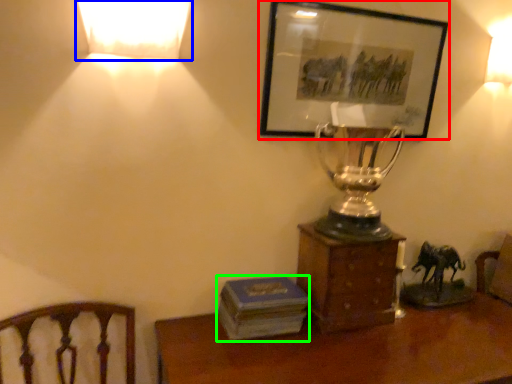
Question: Which object is the closest to the picture frame (highlighted by a red box)? Choose among these: lamp (highlighted by a blue box) or paperback book (highlighted by a green box).

Choices:
 (A) lamp
 (B) paperback book

Answer: (A)